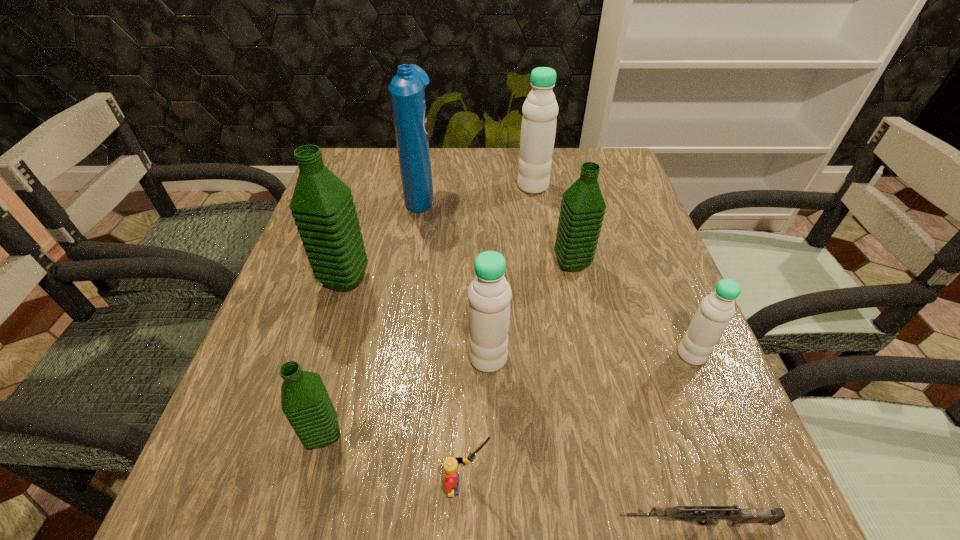
The image size is (960, 540). Identify the location of the seventh object from right to left. (407, 89).

Locate an element on the screen. This screenshot has width=960, height=540. the second white water bottle from left to right is located at coordinates (540, 109).

Where is `the farthest water bottle`? Image resolution: width=960 pixels, height=540 pixels. the farthest water bottle is located at coordinates (540, 109).

Where is `the biggest green water bottle`? Image resolution: width=960 pixels, height=540 pixels. the biggest green water bottle is located at coordinates (322, 205).

You are a GUI agent. You are given a task and a screenshot of the screen. Output one action in this format:
    pyautogui.click(x=<x>, y=<y>)
    Task: Click on the rightmost green water bottle
    This screenshot has width=960, height=540.
    Given the screenshot: What is the action you would take?
    pyautogui.click(x=583, y=207)

Where is `the second smallest white water bottle`? The image size is (960, 540). the second smallest white water bottle is located at coordinates (489, 294).

Identify the location of the third water bottle from left to right. (489, 294).

You are a GUI agent. You are given a task and a screenshot of the screen. Output one action in this format:
    pyautogui.click(x=<x>, y=<y>)
    Task: Click on the rightmost water bottle
    
    Given the screenshot: What is the action you would take?
    pyautogui.click(x=716, y=310)

Find the location of a particular element. the rightmost white water bottle is located at coordinates (716, 310).

Find the location of a particular element. the smallest green water bottle is located at coordinates (305, 402).